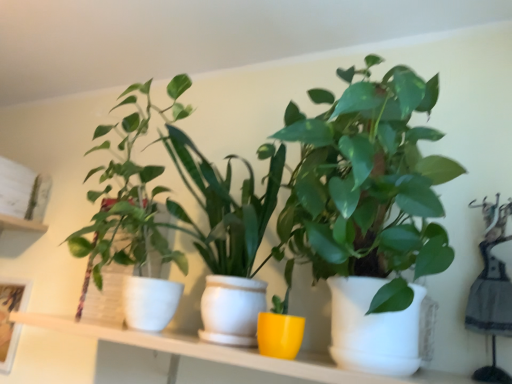
Question: Is green matte plant at center, which is the 2th houseplant from left to right, thinner than woven basket plant at left, placed as the second houseplant when sorted from right to left?

Choices:
 (A) no
 (B) yes

Answer: (A)

Question: Does green matte plant at center, which is the first houseplant in right-to-left order, have a smaller size compared to woven basket plant at left, the 1th houseplant viewed from the left?

Choices:
 (A) yes
 (B) no

Answer: (B)

Question: Does green matte plant at center, which is the first houseplant in right-to-left order, have a greater width compared to woven basket plant at left, placed as the second houseplant when sorted from right to left?

Choices:
 (A) no
 (B) yes

Answer: (B)

Question: Does green matte plant at center, which is the first houseplant in right-to-left order, have a larger size compared to woven basket plant at left, the 1th houseplant viewed from the left?

Choices:
 (A) no
 (B) yes

Answer: (B)

Question: From a real-world perspective, does green matte plant at center, which is the first houseplant in right-to-left order, stand above woven basket plant at left, placed as the second houseplant when sorted from right to left?

Choices:
 (A) no
 (B) yes

Answer: (B)

Question: Is green matte plant at center, which is the 2th houseplant from left to right, completely or partially outside of woven basket plant at left, placed as the second houseplant when sorted from right to left?

Choices:
 (A) no
 (B) yes

Answer: (B)

Question: Is green matte plant at center, which is the first houseplant in right-to-left order, aimed at white ceramic shelf at center?

Choices:
 (A) no
 (B) yes

Answer: (A)

Question: Considering the relative sizes of green matte plant at center, which is the first houseplant in right-to-left order, and white ceramic shelf at center in the image provided, is green matte plant at center, which is the first houseplant in right-to-left order, shorter than white ceramic shelf at center?

Choices:
 (A) no
 (B) yes

Answer: (A)

Question: From the image's perspective, is green matte plant at center, which is the first houseplant in right-to-left order, below white ceramic shelf at center?

Choices:
 (A) no
 (B) yes

Answer: (A)

Question: Does green matte plant at center, which is the 2th houseplant from left to right, lie behind white ceramic shelf at center?

Choices:
 (A) no
 (B) yes

Answer: (A)

Question: Can you confirm if green matte plant at center, which is the 2th houseplant from left to right, is smaller than white ceramic shelf at center?

Choices:
 (A) no
 (B) yes

Answer: (A)

Question: Is green matte plant at center, which is the 2th houseplant from left to right, looking in the opposite direction of white ceramic shelf at center?

Choices:
 (A) yes
 (B) no

Answer: (B)

Question: Would you say woven basket plant at left, the 1th houseplant viewed from the left, is part of white ceramic shelf at center's contents?

Choices:
 (A) yes
 (B) no

Answer: (B)